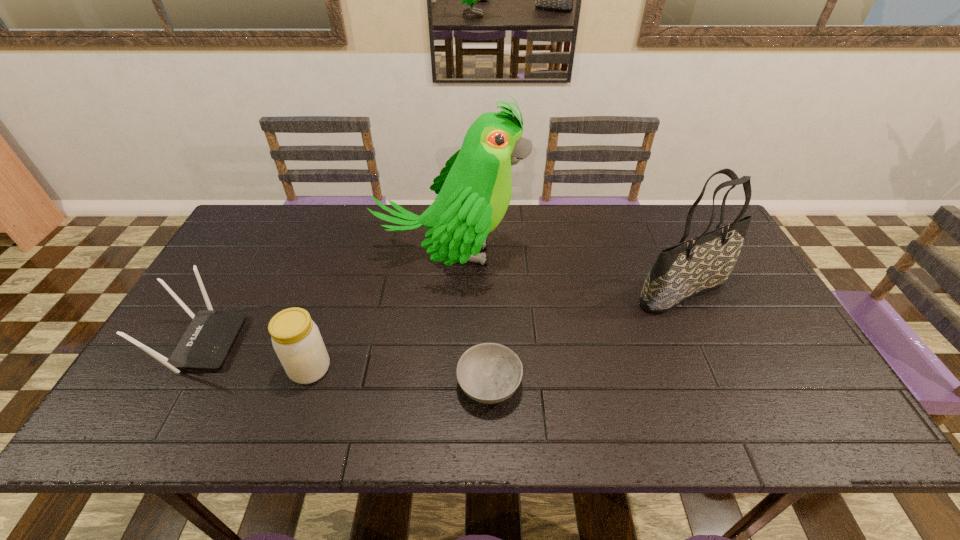
At what (x,y) coordinates should I click in order to perform the action: click on vacant space located on the back of the bowl. Please return your answer as a coordinate pair (x, y). The width and height of the screenshot is (960, 540). Looking at the image, I should click on (488, 304).

Locate an element on the screen. The height and width of the screenshot is (540, 960). object positioned at the far edge is located at coordinates (474, 189).

At what (x,y) coordinates should I click in order to perform the action: click on object positioned at the near edge. Please return your answer as a coordinate pair (x, y). The height and width of the screenshot is (540, 960). Looking at the image, I should click on (489, 373).

Locate an element on the screen. This screenshot has width=960, height=540. object at the left edge is located at coordinates (205, 344).

Identify the location of object that is at the right edge. pyautogui.click(x=704, y=263).

This screenshot has width=960, height=540. In the image, there is a desktop. In order to click on free space at the far edge in this screenshot , I will do `click(534, 248)`.

You are a GUI agent. You are given a task and a screenshot of the screen. Output one action in this format:
    pyautogui.click(x=<x>, y=<y>)
    Task: Click on the free space at the near edge
    
    Given the screenshot: What is the action you would take?
    pyautogui.click(x=210, y=406)

Locate an element on the screen. The image size is (960, 540). free region at the left edge of the desktop is located at coordinates (213, 380).

This screenshot has height=540, width=960. I want to click on vacant area at the right edge, so click(715, 306).

At what (x,y) coordinates should I click in order to perform the action: click on vacant space at the far left corner of the desktop. Please return your answer as a coordinate pair (x, y). Image resolution: width=960 pixels, height=540 pixels. Looking at the image, I should click on (276, 217).